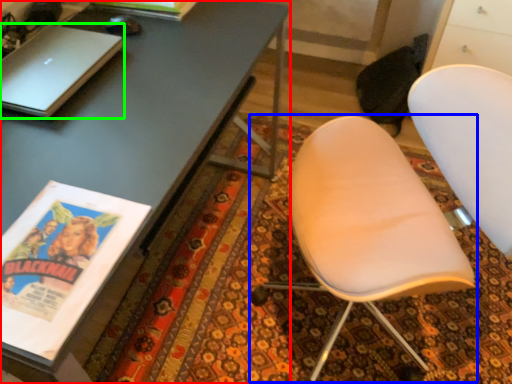
Question: Considering the real-world distances, which object is closest to desk (highlighted by a red box)? chair (highlighted by a blue box) or laptop (highlighted by a green box).

Choices:
 (A) chair
 (B) laptop

Answer: (B)